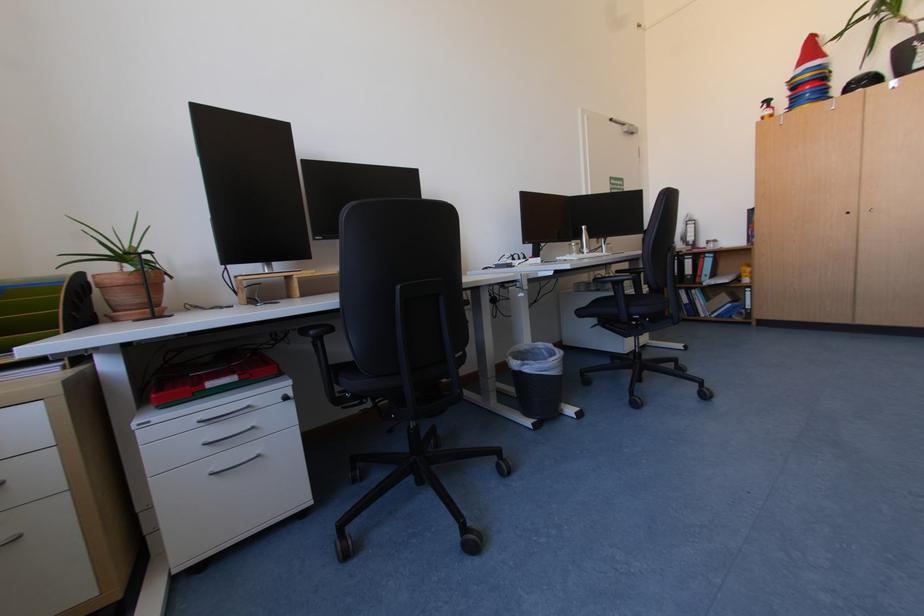
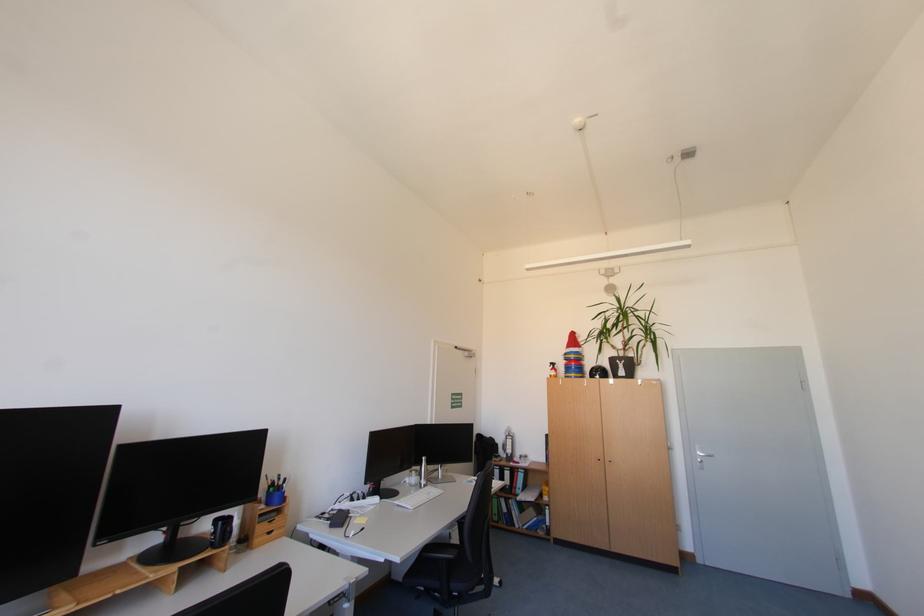
How did the camera likely rotate?

The camera rotated toward right-up.